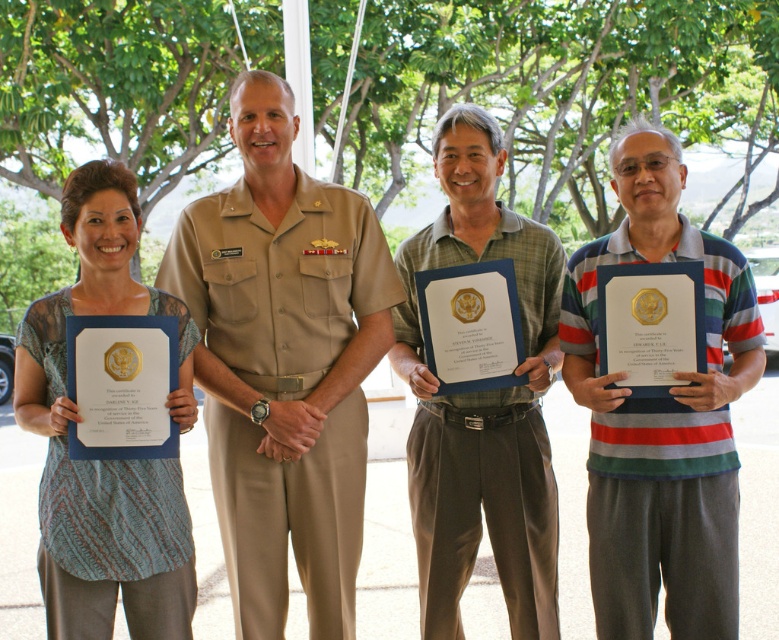
Does tan uniform at center appear under striped cotton polo shirt at right?

Actually, tan uniform at center is above striped cotton polo shirt at right.

Who is taller, tan uniform at center or striped cotton polo shirt at right?

Standing taller between the two is tan uniform at center.

In order to click on tan uniform at center in this screenshot , I will do `click(284, 364)`.

Does point (73, 605) lie in front of point (527, 483)?

Yes, point (73, 605) is in front of point (527, 483).

Is point (90, 268) positioned before point (502, 413)?

That is True.

I want to click on printed fabric shirt at center, so click(104, 460).

Which is more to the right, striped cotton polo shirt at right or green fabric shirt at center?

striped cotton polo shirt at right is more to the right.

Can you confirm if striped cotton polo shirt at right is wider than green fabric shirt at center?

No, striped cotton polo shirt at right is not wider than green fabric shirt at center.

This screenshot has width=779, height=640. I want to click on striped cotton polo shirt at right, so click(x=661, y=417).

The height and width of the screenshot is (640, 779). In order to click on striped cotton polo shirt at right in this screenshot , I will do `click(661, 417)`.